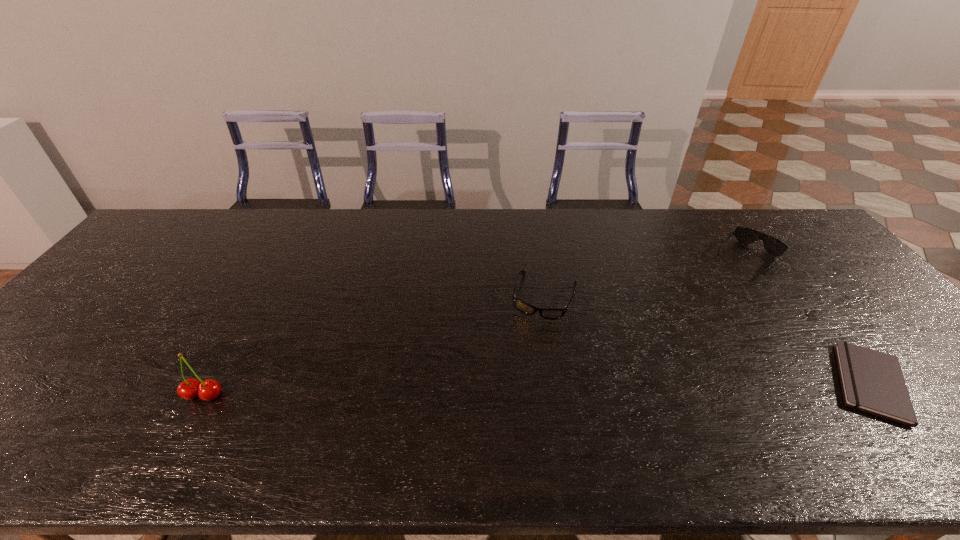
Identify the location of vacant position located on the front-facing side of the spectacles. This screenshot has height=540, width=960. (510, 414).

Where is `free region located 0.240m on the front-facing side of the spectacles`? free region located 0.240m on the front-facing side of the spectacles is located at coordinates (516, 396).

Identify the location of object that is at the far edge. This screenshot has width=960, height=540. (772, 245).

Locate an element on the screen. The image size is (960, 540). cherry present at the near edge is located at coordinates (189, 389).

Find the location of a particular element. checkbook that is at the near edge is located at coordinates (871, 381).

At what (x,y) coordinates should I click in order to perform the action: click on object located at the right edge. Please return your answer as a coordinate pair (x, y). The height and width of the screenshot is (540, 960). Looking at the image, I should click on (871, 381).

The image size is (960, 540). In order to click on object at the near right corner in this screenshot , I will do `click(871, 381)`.

Find the location of a particular element. The width and height of the screenshot is (960, 540). free region at the far edge of the desktop is located at coordinates (204, 228).

In the image, there is a desktop. Identify the location of free space at the near edge. (380, 400).

This screenshot has width=960, height=540. I want to click on vacant space at the left edge, so click(x=100, y=326).